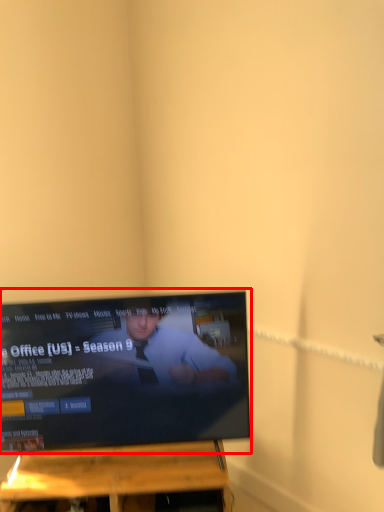
Question: From the image, what is the correct spatial relationship of television (annotated by the red box) in relation to furniture?

Choices:
 (A) left
 (B) right

Answer: (A)